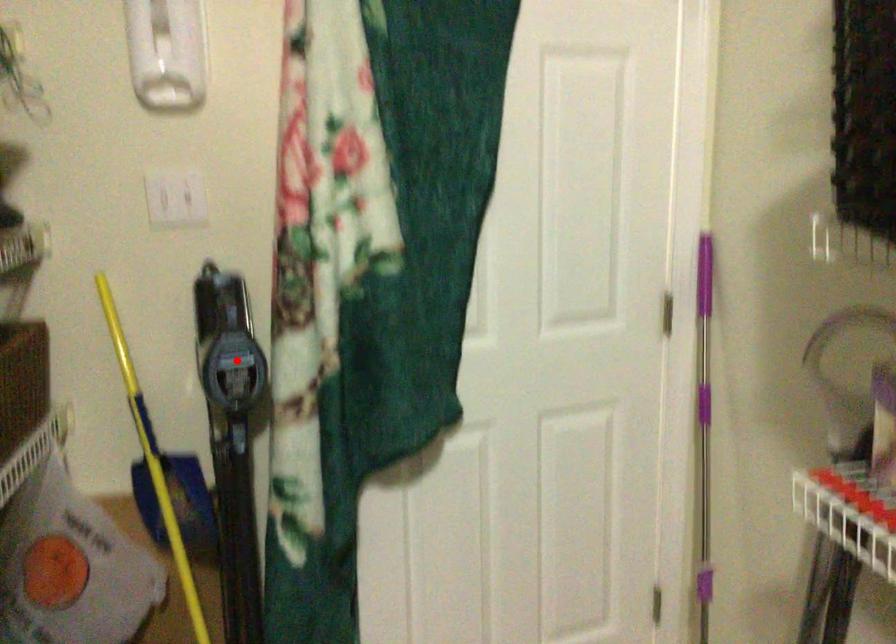
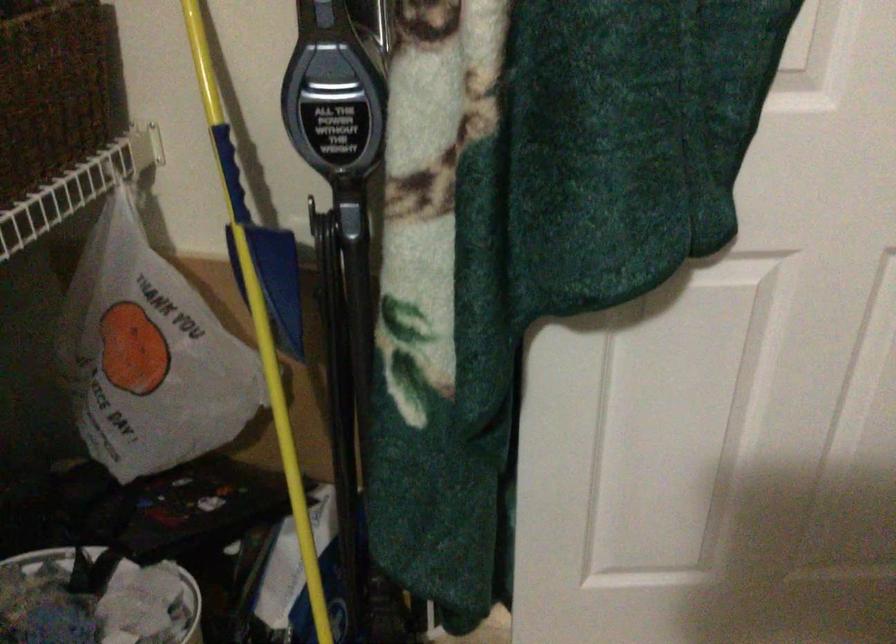
Locate, in the second image, the point that corresponds to the highlighted location in the first image.

(332, 93)